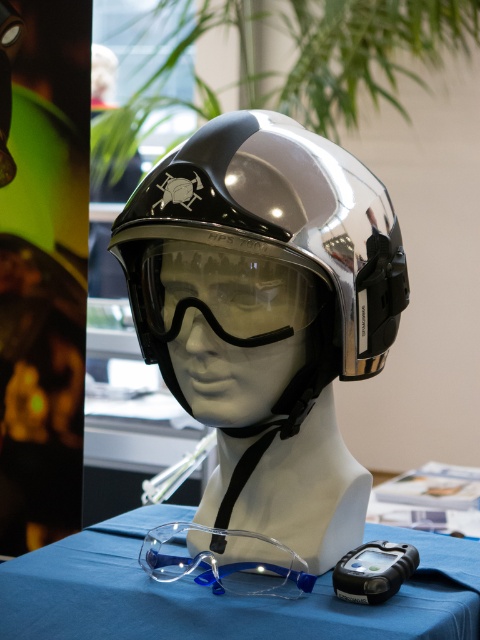
Question: Is shiny metallic helmet at center below clear plastic safety glasses at lower center?

Choices:
 (A) no
 (B) yes

Answer: (A)

Question: Among these points, which one is farthest from the camera?

Choices:
 (A) (300, 628)
 (B) (316, 285)
 (C) (155, 570)

Answer: (C)

Question: From the image, what is the correct spatial relationship of shiny metallic helmet at center in relation to transparent plastic goggles at lower center?

Choices:
 (A) right
 (B) left

Answer: (A)

Question: Which object is the farthest from the clear plastic safety glasses at lower center?

Choices:
 (A) transparent plastic goggles at lower center
 (B) shiny metallic helmet at center

Answer: (B)

Question: Which object is the farthest from the clear plastic safety glasses at lower center?

Choices:
 (A) shiny metallic helmet at center
 (B) transparent plastic goggles at lower center

Answer: (A)

Question: Is clear plastic safety glasses at lower center thinner than transparent plastic goggles at lower center?

Choices:
 (A) no
 (B) yes

Answer: (A)